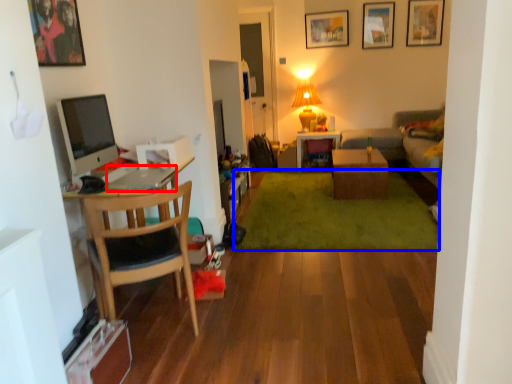
Question: Which object is further to the camera taking this photo, laptop (highlighted by a red box) or plain (highlighted by a blue box)?

Choices:
 (A) laptop
 (B) plain

Answer: (B)